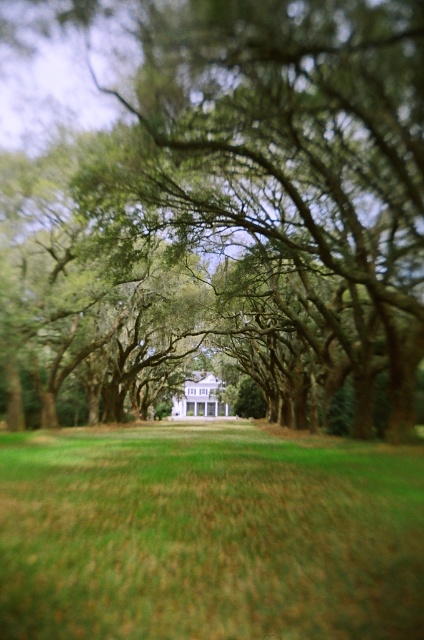
Question: Is green leafy tree at center to the left of green grass at center from the viewer's perspective?

Choices:
 (A) no
 (B) yes

Answer: (B)

Question: Does green leafy tree at center appear under green grass at center?

Choices:
 (A) yes
 (B) no

Answer: (A)

Question: Observing the image, what is the correct spatial positioning of green leafy tree at center in reference to green grass at center?

Choices:
 (A) left
 (B) right

Answer: (A)

Question: Which object appears farthest from the camera in this image?

Choices:
 (A) green leafy tree at center
 (B) green grass at center

Answer: (A)

Question: Which object appears closest to the camera in this image?

Choices:
 (A) green grass at center
 (B) green leafy tree at center

Answer: (A)